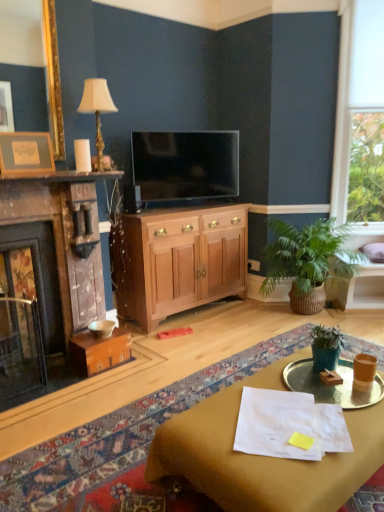
Find the location of `vacant space to the right of black plastic phone at center`. vacant space to the right of black plastic phone at center is located at coordinates (152, 210).